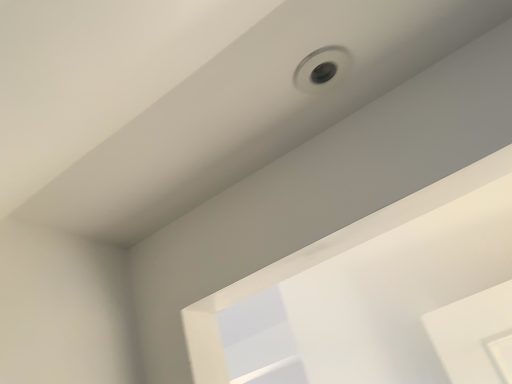
This screenshot has height=384, width=512. What are the coordinates of `white matte window frame at upper center` in the screenshot? It's located at (324, 259).

Describe the element at coordinates (324, 259) in the screenshot. I see `white matte window frame at upper center` at that location.

Find the location of a particular element. The image size is (512, 384). white matte window frame at upper center is located at coordinates (324, 259).